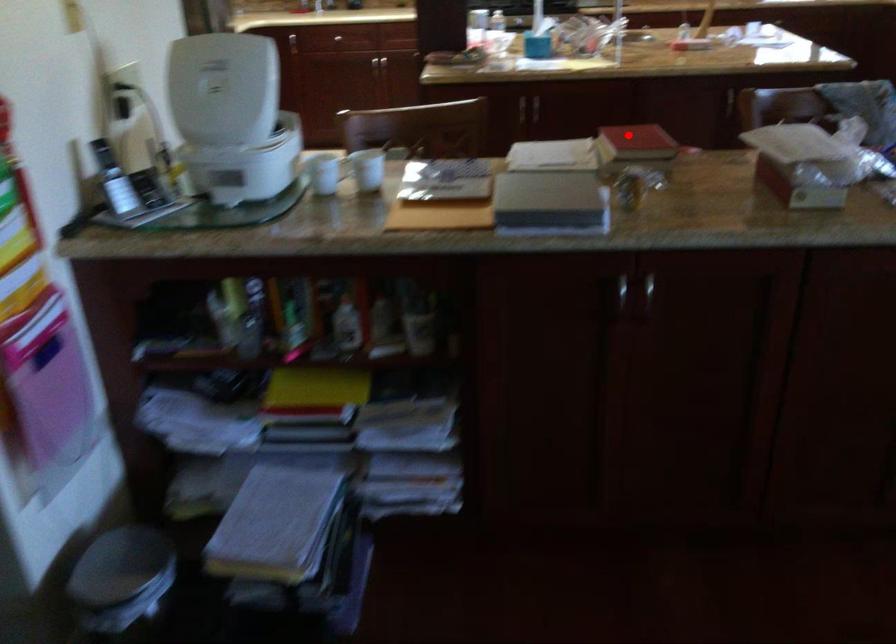
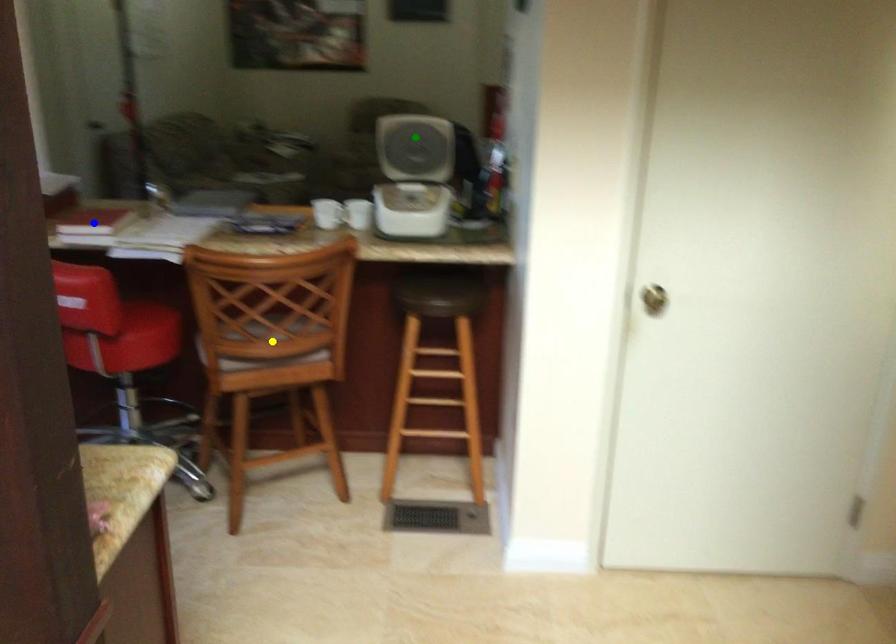
Question: I am providing you with two images of the same scene from different viewpoints. A red point is marked on the first image. You are given multiple points on the second image. Which mark in image 2 goes with the point in image 1?

Choices:
 (A) yellow point
 (B) green point
 (C) blue point

Answer: (C)